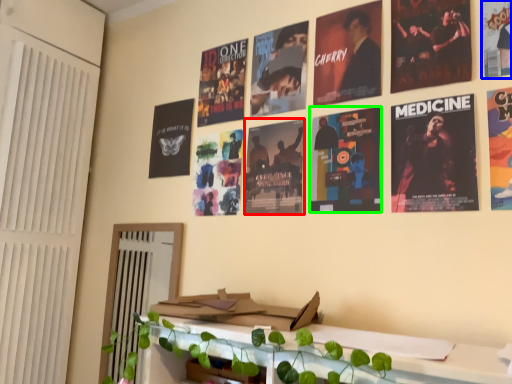
Question: Based on their relative distances, which object is nearer to poster (highlighted by a red box)? Choose from poster (highlighted by a blue box) and poster (highlighted by a green box).

Choices:
 (A) poster
 (B) poster

Answer: (B)